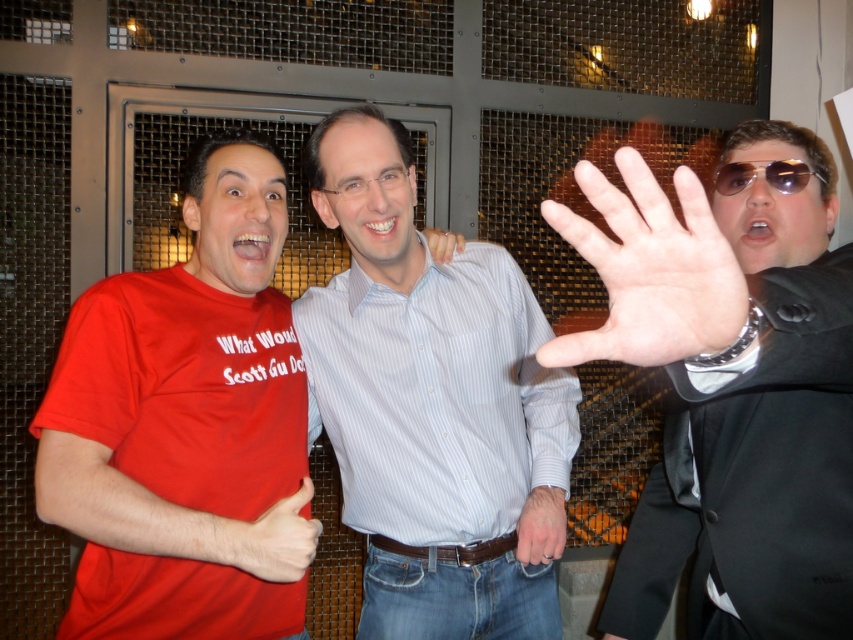
Question: Is matte red t-shirt at left below light blue striped shirt at center?

Choices:
 (A) yes
 (B) no

Answer: (B)

Question: Which object is the farthest from the matte red t-shirt at lower left?

Choices:
 (A) smooth skin hand at center
 (B) matte skin hand at center
 (C) shiny black suit at right
 (D) light blue striped shirt at center

Answer: (C)

Question: Can you confirm if shiny black suit at right is positioned to the right of matte red t-shirt at lower left?

Choices:
 (A) no
 (B) yes

Answer: (B)

Question: Which is nearer to the light blue striped shirt at center?

Choices:
 (A) shiny black suit at right
 (B) matte skin hand at center
 (C) matte red t-shirt at left
 (D) matte red t-shirt at lower left

Answer: (B)

Question: Can you confirm if sunglasses at center is wider than matte skin hand at center?

Choices:
 (A) yes
 (B) no

Answer: (A)

Question: Which object appears closest to the camera in this image?

Choices:
 (A) sunglasses at center
 (B) matte red t-shirt at lower left
 (C) smooth skin hand at center

Answer: (B)